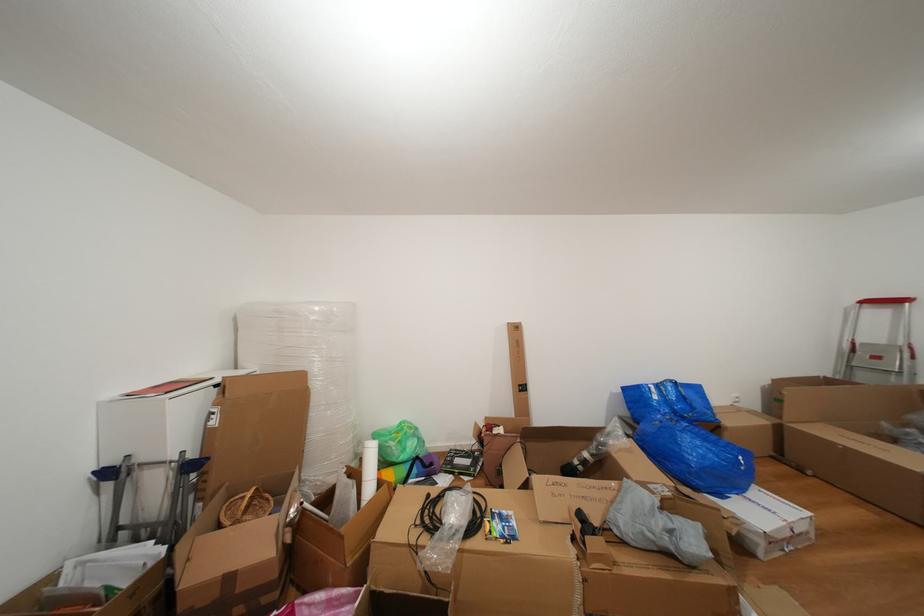
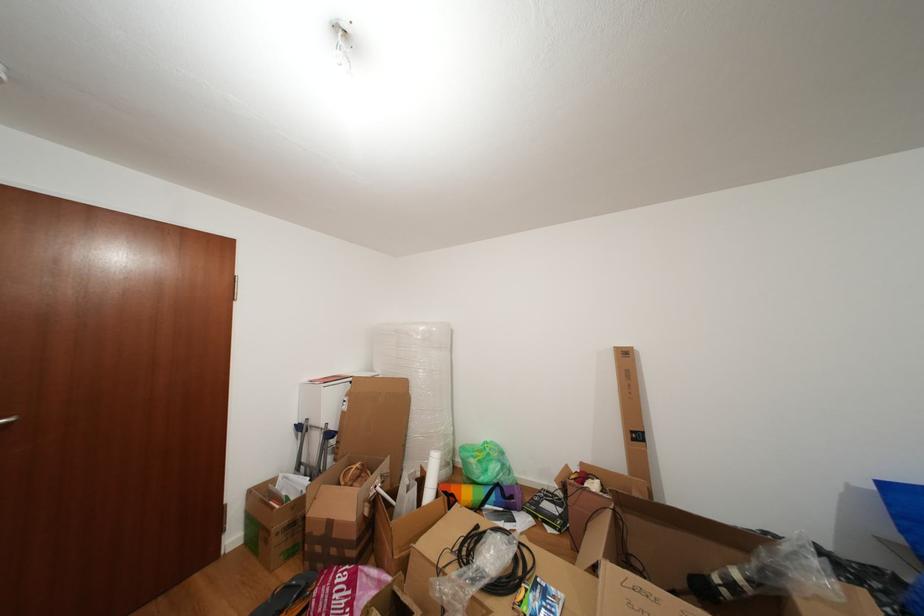
Find the pixel in the second image that matches point 412,454 in the first image.

(494, 476)